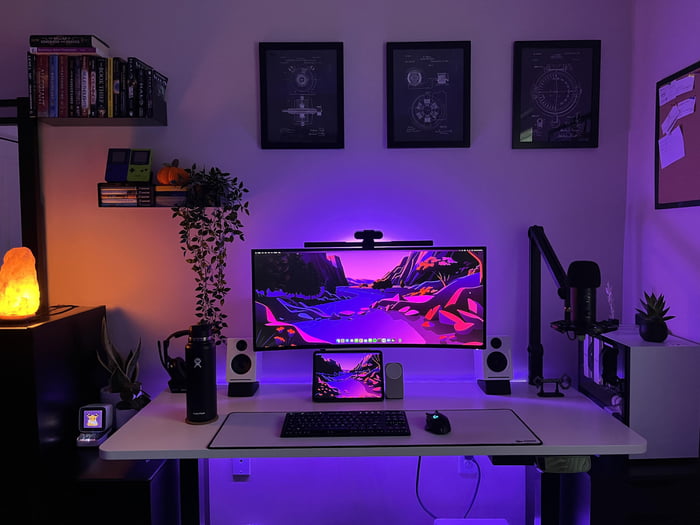
Identify the location of keyboard. This screenshot has width=700, height=525. (368, 424).